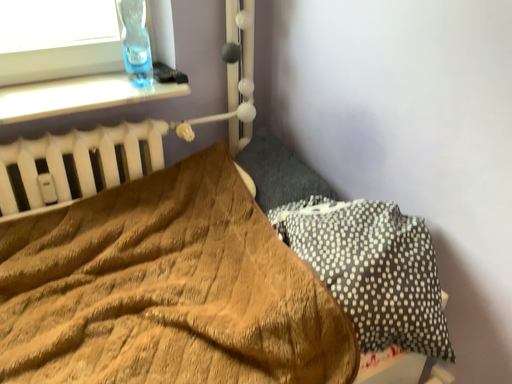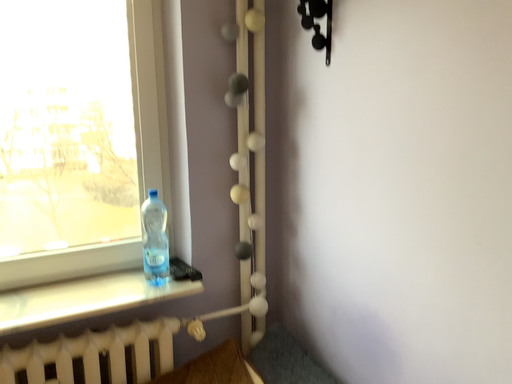
Question: How did the camera likely rotate when shooting the video?

Choices:
 (A) rotated downward
 (B) rotated upward

Answer: (B)